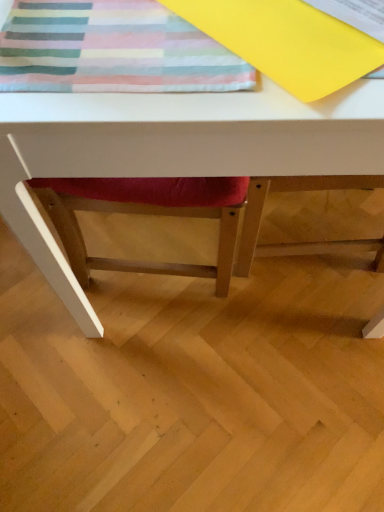
The width and height of the screenshot is (384, 512). Describe the element at coordinates (174, 149) in the screenshot. I see `white matte table at center` at that location.

In the scene shown: In order to face white matte table at center, should I rotate leftwards or rightwards?

Turn right by 5.367 degrees to look at white matte table at center.

This screenshot has width=384, height=512. Find the location of `white matte table at center`. white matte table at center is located at coordinates (174, 149).

Locate an element on the screen. The image size is (384, 512). white matte table at center is located at coordinates (174, 149).